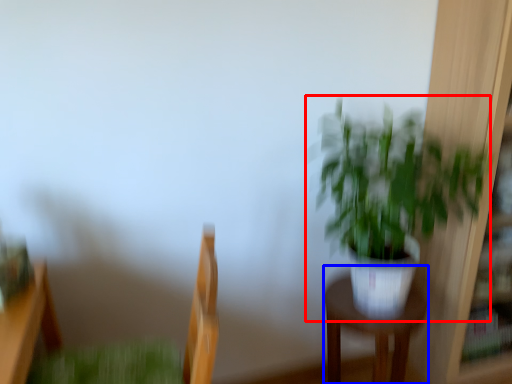
Question: Which of the following is the closest to the observer, houseplant (highlighted by a red box) or furniture (highlighted by a blue box)?

Choices:
 (A) houseplant
 (B) furniture

Answer: (A)